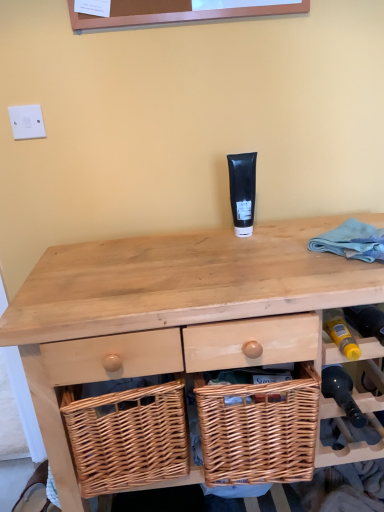
The width and height of the screenshot is (384, 512). What are the coordinates of `free space in front of black matte tube at center` in the screenshot? It's located at (259, 254).